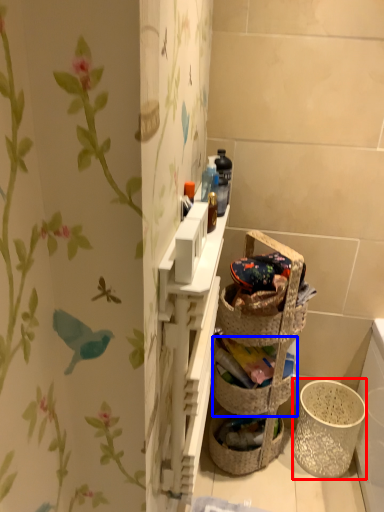
Question: Which point is further to the camera, basket container (highlighted by a red box) or basket container (highlighted by a blue box)?

Choices:
 (A) basket container
 (B) basket container

Answer: (A)